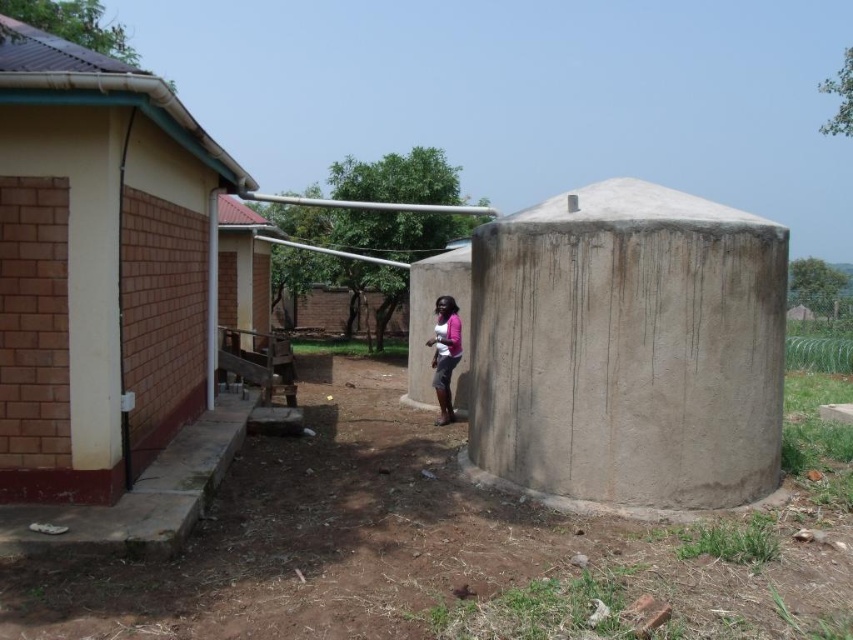
Question: Can you confirm if brown brick wall at left is positioned to the right of pink fabric at center?

Choices:
 (A) yes
 (B) no

Answer: (B)

Question: Does brown brick wall at left come in front of pink fabric at center?

Choices:
 (A) no
 (B) yes

Answer: (B)

Question: Considering the real-world distances, which object is farthest from the brown soil at center?

Choices:
 (A) pink fabric at center
 (B) brown brick wall at left

Answer: (A)

Question: Which point is farther to the camera?

Choices:
 (A) (305, 602)
 (B) (456, 336)

Answer: (B)

Question: Can you confirm if brown brick wall at left is positioned above pink fabric at center?

Choices:
 (A) yes
 (B) no

Answer: (A)

Question: Among these objects, which one is farthest from the camera?

Choices:
 (A) gray concrete tank at center
 (B) pink fabric at center

Answer: (B)